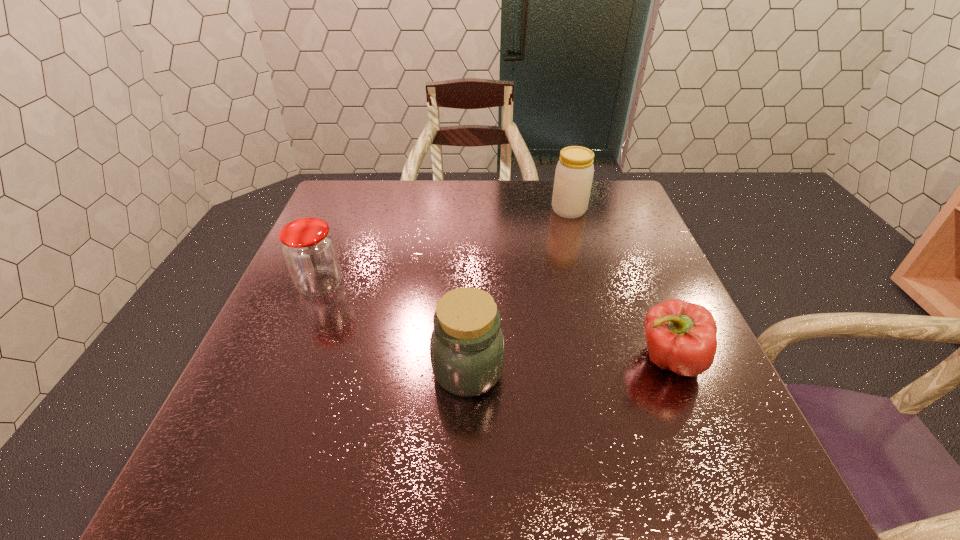
I want to click on vacant position located on the back of the shortest object, so click(647, 306).

This screenshot has height=540, width=960. Identify the location of object that is at the far edge. (574, 172).

You are a GUI agent. You are given a task and a screenshot of the screen. Output one action in this format:
    pyautogui.click(x=<x>, y=<y>)
    Task: Click on the object that is at the left edge
    The height and width of the screenshot is (540, 960).
    Given the screenshot: What is the action you would take?
    pyautogui.click(x=309, y=250)

Find the location of a particular element. The image size is (960, 540). jar present at the right edge is located at coordinates (574, 172).

Where is `bell pepper present at the right edge`? bell pepper present at the right edge is located at coordinates coord(681,336).

Find the location of `object situated at the far right corner`. object situated at the far right corner is located at coordinates (574, 172).

Locate an element on the screen. This screenshot has width=960, height=540. vacant region at the far edge of the desktop is located at coordinates (390, 221).

At what (x,y) coordinates should I click in order to perform the action: click on blank space at the near edge. Please return your answer as a coordinate pair (x, y). Looking at the image, I should click on (399, 472).

In the image, there is a desktop. Where is `vacant space at the left edge`? This screenshot has height=540, width=960. vacant space at the left edge is located at coordinates (267, 400).

This screenshot has width=960, height=540. In order to click on vacant space at the right edge of the desktop in this screenshot , I will do `click(648, 231)`.